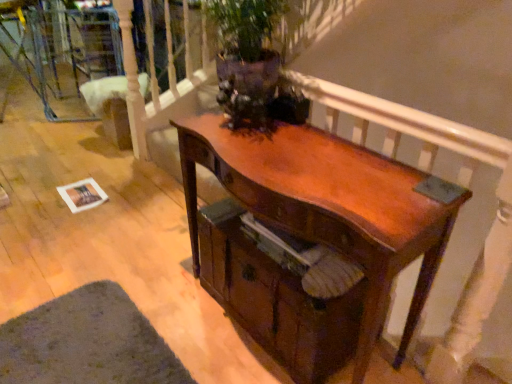
Where is `vacant space situated on the left part of shiny brown drawer at center`? vacant space situated on the left part of shiny brown drawer at center is located at coordinates (175, 296).